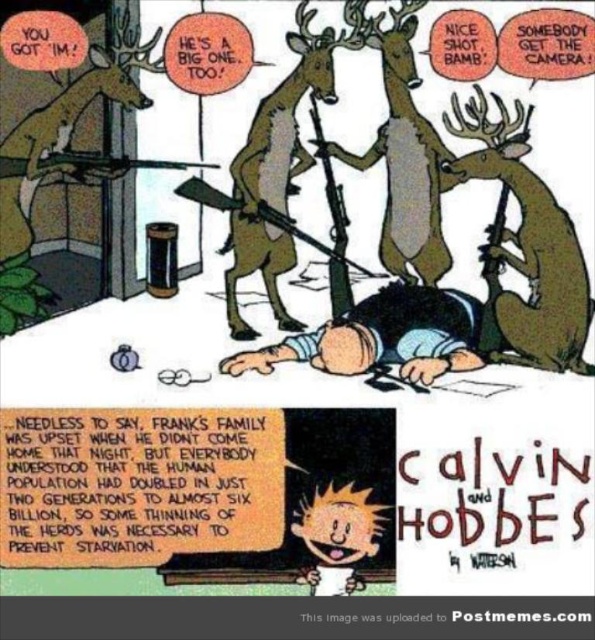
Question: Which object appears closest to the camera in this image?

Choices:
 (A) smooth yellow hair at center
 (B) brown matte rifle at center
 (C) brown matte deer at center
 (D) black matte person at lower center

Answer: (A)

Question: Does brown matte deer at center have a smaller size compared to brown fur deer at center?

Choices:
 (A) no
 (B) yes

Answer: (B)

Question: Is brown matte deer at center below smooth yellow hair at center?

Choices:
 (A) yes
 (B) no

Answer: (B)

Question: Which point is closer to the camera taking this photo?

Choices:
 (A) (490, 339)
 (B) (339, 522)
 (C) (444, 298)

Answer: (B)

Question: Among these points, which one is farthest from the camera?

Choices:
 (A) (347, 218)
 (B) (298, 168)

Answer: (A)

Question: Can you confirm if brown matte deer at center is positioned below brown fur deer at center?

Choices:
 (A) no
 (B) yes

Answer: (B)